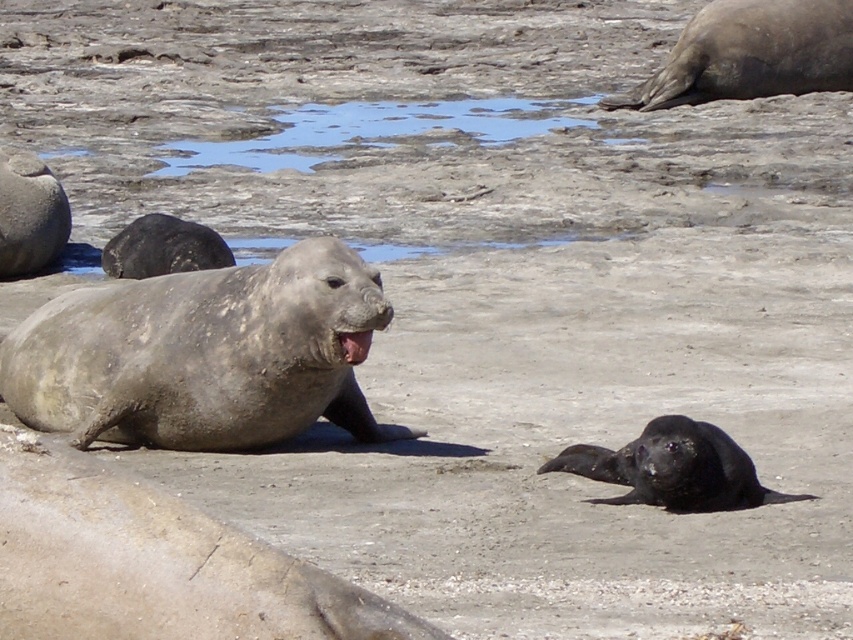
Is point (737, 97) less distant than point (682, 435)?

No, it is not.

Can you confirm if gray matte seal at upper right is bigger than black fur seal at lower right?

Yes.

I want to click on gray matte seal at upper right, so click(751, 52).

From the picture: Is gray matte seal mouth at left wider than gray matte seal at upper right?

In fact, gray matte seal mouth at left might be narrower than gray matte seal at upper right.

Is point (339, 420) more distant than point (805, 8)?

That is False.

Is point (76, 340) behind point (786, 77)?

No, (76, 340) is in front of (786, 77).

Find the location of a particular element. gray matte seal mouth at left is located at coordinates (202, 355).

Who is positioned more to the left, gray matte seal mouth at left or gray matte seal mouth at center?

From the viewer's perspective, gray matte seal mouth at left appears more on the left side.

What do you see at coordinates (202, 355) in the screenshot? This screenshot has height=640, width=853. I see `gray matte seal mouth at left` at bounding box center [202, 355].

Locate an element on the screen. The height and width of the screenshot is (640, 853). gray matte seal mouth at left is located at coordinates (202, 355).